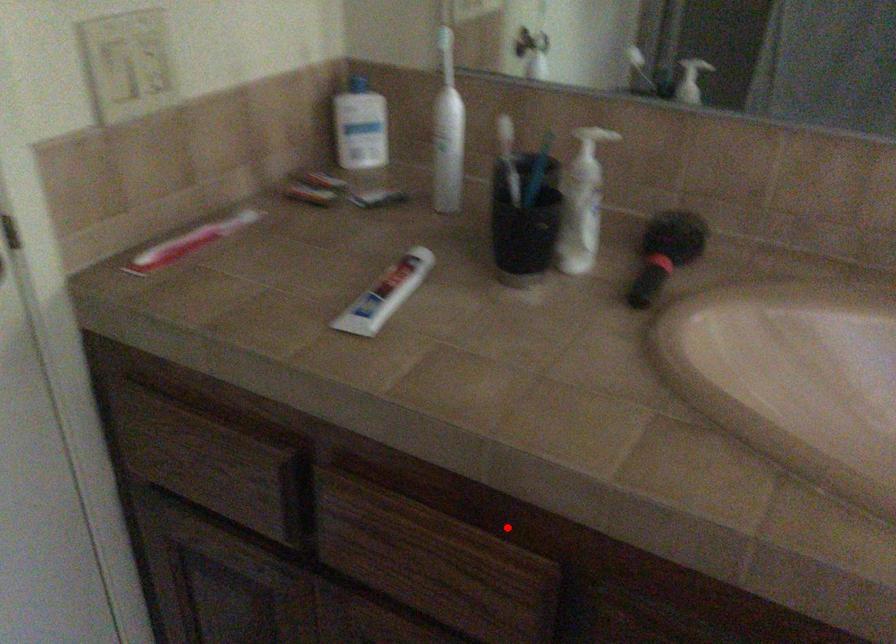
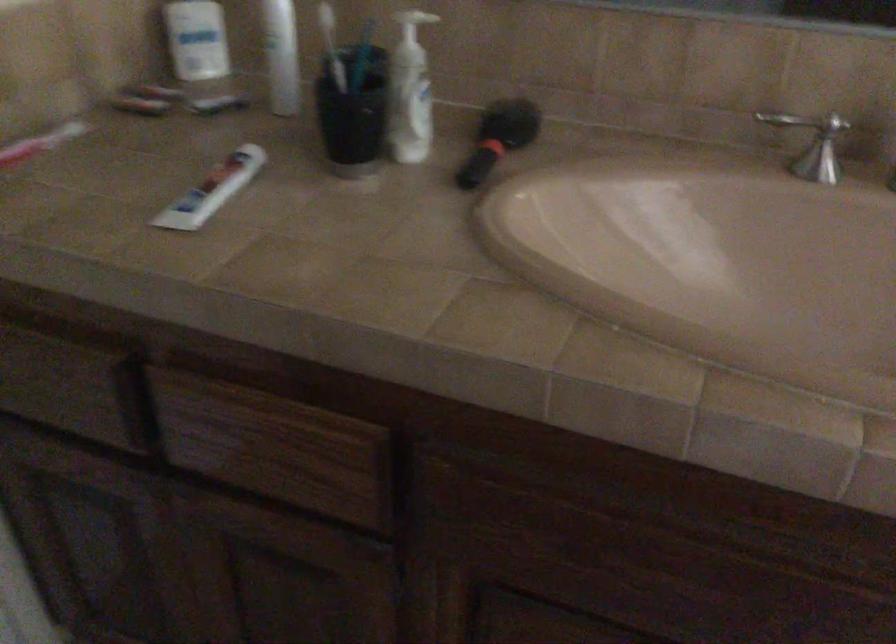
Locate, in the second image, the point that corresponds to the highlighted location in the first image.

(341, 404)